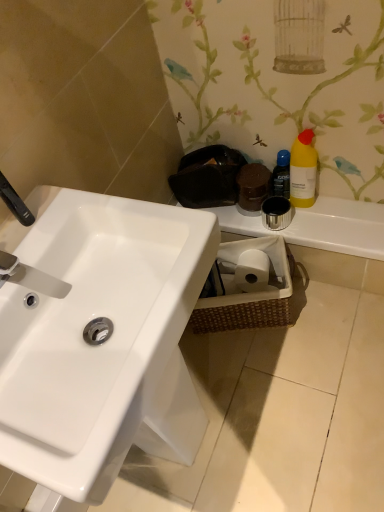
Where is `free space between white glossy sink at center and woven brown basket at lower right`? free space between white glossy sink at center and woven brown basket at lower right is located at coordinates (261, 365).